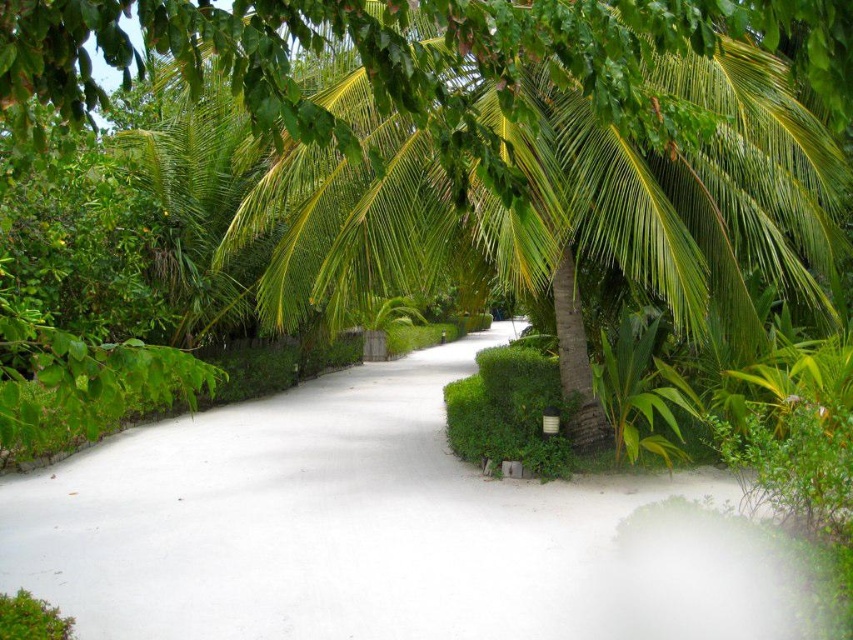
You are standing at point (367, 76) and want to walk to point (509, 595). Is the path blocked by the hedges on either side?

The path is not blocked by the hedges on either side because the path is bordered by neatly trimmed green hedges on both sides, allowing passage from point (367, 76) to point (509, 595).

You are standing on the white sand path at center and looking towards the green leafy coconut tree at center. Which object is taller?

The green leafy coconut tree at center is taller than the white sand path at center.

You are standing on the white sand path at center and want to walk towards the green leafy coconut tree at center. Which direction should you move to reach it?

The white sand path at center is positioned under the green leafy coconut tree at center, so you should move forward along the path to reach it.